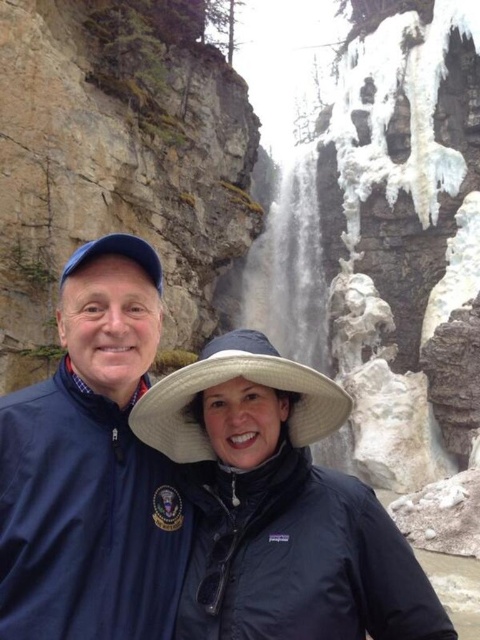
Question: Which of the following is the farthest from the observer?

Choices:
 (A) (218, 371)
 (B) (115, 288)

Answer: (B)

Question: Is black matte jacket at center behind blue fabric jacket at left?

Choices:
 (A) yes
 (B) no

Answer: (A)

Question: Does black matte jacket at center appear on the right side of blue fabric jacket at left?

Choices:
 (A) no
 (B) yes

Answer: (B)

Question: Is black matte jacket at center to the left of blue fabric jacket at left from the viewer's perspective?

Choices:
 (A) yes
 (B) no

Answer: (B)

Question: Among these objects, which one is nearest to the camera?

Choices:
 (A) black matte jacket at center
 (B) blue fabric jacket at left

Answer: (B)